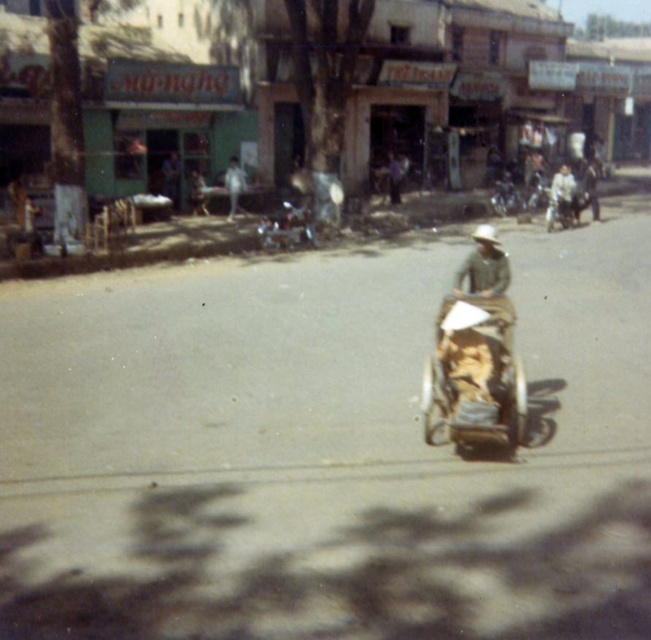
You are a delivery person who needs to load a package onto the wooden textured baby carriage at center and the metallic silver motorcycle at center. Which one can carry the package more easily?

The metallic silver motorcycle at center is larger than the wooden textured baby carriage at center, so it can carry the package more easily.

You are a photographer standing in the street scene. You want to take a photo of the wooden textured baby carriage at center and the metallic silver motorcycle at center. Which object should you focus on first if you want to capture both in sharp focus?

The wooden textured baby carriage at center is closer to the viewer than the metallic silver motorcycle at center. To capture both in sharp focus, you should focus on the metallic silver motorcycle at center because it is farther away, ensuring the depth of field includes both objects.